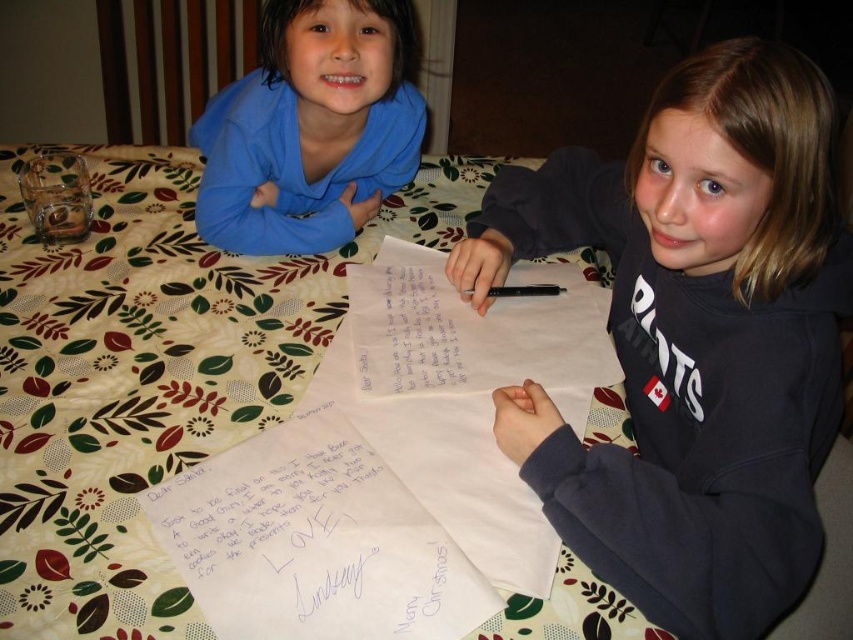
Question: Which of the following is the farthest from the observer?

Choices:
 (A) floral fabric table at center
 (B) black plastic pen at center

Answer: (B)

Question: Observing the image, what is the correct spatial positioning of dark gray sweatshirt at center in reference to white paper at center?

Choices:
 (A) above
 (B) below

Answer: (A)

Question: Is white paper at center further to camera compared to black plastic pen at center?

Choices:
 (A) yes
 (B) no

Answer: (B)

Question: Which point appears closest to the camera in this image?

Choices:
 (A) (436, 621)
 (B) (329, 67)
 (C) (717, 180)
 (D) (556, 294)

Answer: (A)

Question: Among these points, which one is nearest to the camera?

Choices:
 (A) (4, 586)
 (B) (554, 289)
 (C) (465, 627)

Answer: (C)

Question: Can you confirm if white paper at center is positioned below matte blue hoodie at upper left?

Choices:
 (A) yes
 (B) no

Answer: (A)